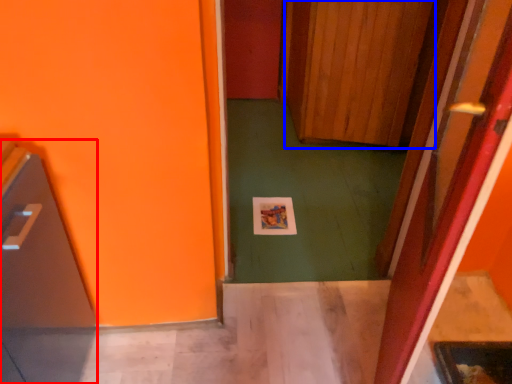
Question: Which of the following is the closest to the observer, appliance (highlighted by a red box) or door (highlighted by a blue box)?

Choices:
 (A) appliance
 (B) door

Answer: (A)